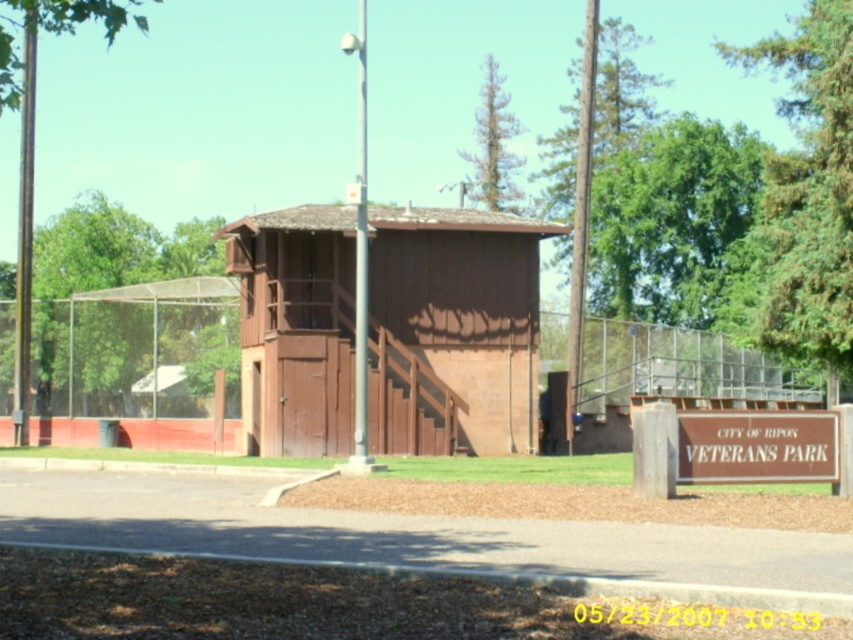
Question: Which object is the farthest from the green textured pine tree at upper center?

Choices:
 (A) brown wooden fence at center
 (B) clear plastic fence at left
 (C) green leafy tree at upper left

Answer: (C)

Question: Which object is farther from the camera taking this photo?

Choices:
 (A) green leafy tree at upper left
 (B) brown wooden fence at center
 (C) clear plastic fence at left
 (D) brown wood hut at center

Answer: (C)

Question: Can you confirm if clear plastic fence at left is thinner than brown wooden fence at center?

Choices:
 (A) yes
 (B) no

Answer: (A)

Question: Among these points, which one is farthest from the camera?

Choices:
 (A) (827, 445)
 (B) (480, 200)

Answer: (B)

Question: Where is clear plastic fence at left located in relation to green leafy tree at upper left in the image?

Choices:
 (A) right
 (B) left

Answer: (A)

Question: Can you confirm if brown wooden fence at center is thinner than green textured pine tree at upper center?

Choices:
 (A) no
 (B) yes

Answer: (A)